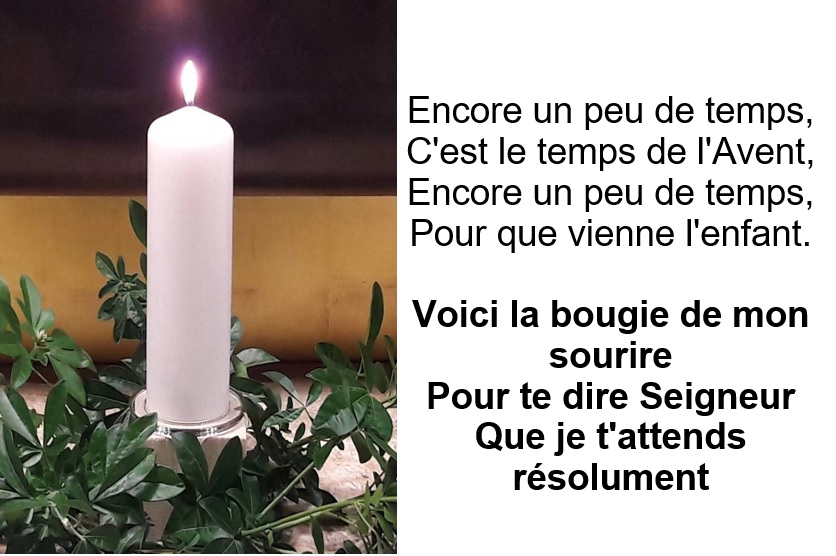
The width and height of the screenshot is (836, 556). In order to click on candle holder in this screenshot , I will do `click(232, 418)`.